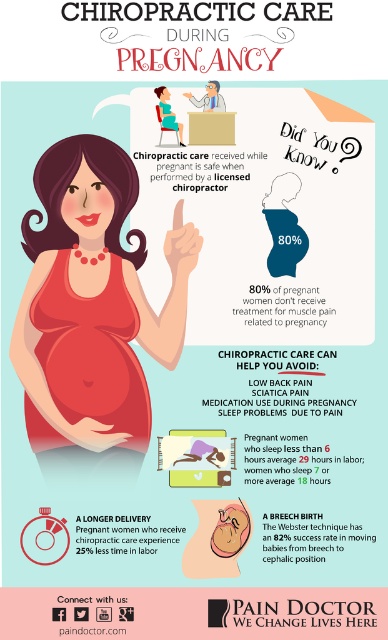
Question: Is the position of matte red dress at center less distant than that of matte red stomach at center?

Choices:
 (A) yes
 (B) no

Answer: (A)

Question: Is matte red dress at center closer to the viewer compared to matte red stomach at center?

Choices:
 (A) no
 (B) yes

Answer: (B)

Question: Which point appears farthest from the camera in this image?

Choices:
 (A) 76,376
 (B) 121,355

Answer: (B)

Question: Does matte red dress at center appear over matte red stomach at center?

Choices:
 (A) yes
 (B) no

Answer: (A)